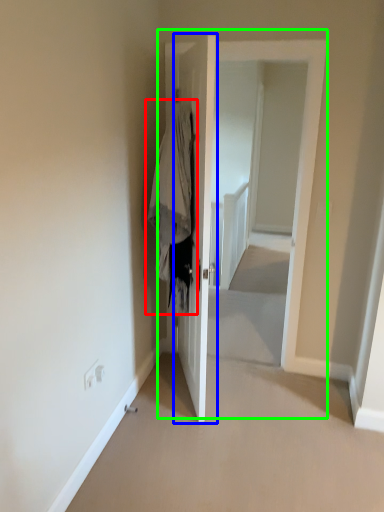
Question: Based on their relative distances, which object is nearer to clothing (highlighted by a red box)? Choose from door (highlighted by a blue box) and door (highlighted by a green box).

Choices:
 (A) door
 (B) door

Answer: (A)